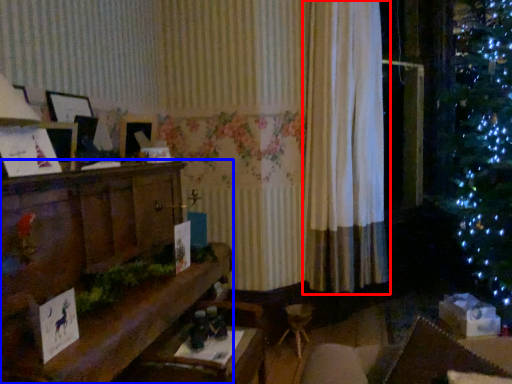
Question: Which object appears closest to the camera in this image, curtain (highlighted by a red box) or furniture (highlighted by a blue box)?

Choices:
 (A) curtain
 (B) furniture

Answer: (B)